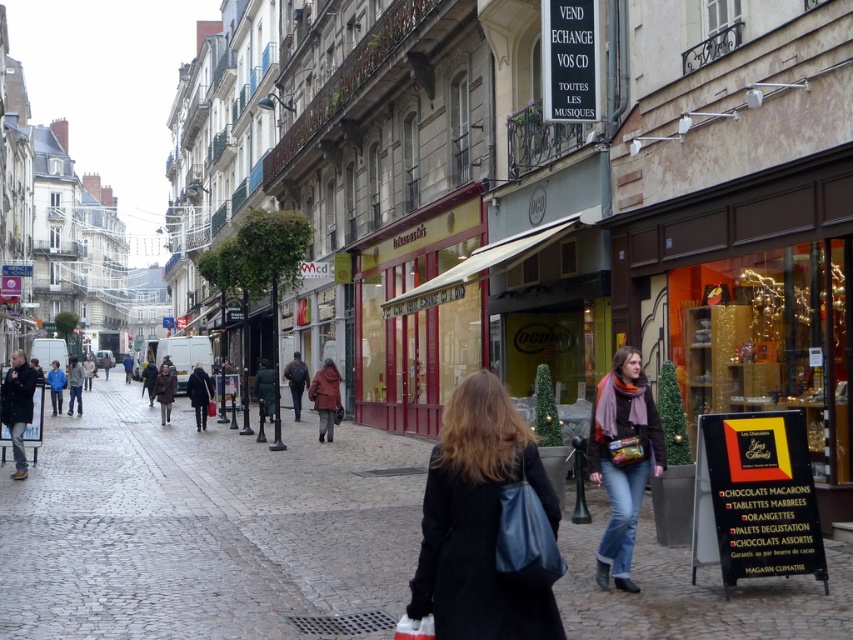
Question: Which of the following is the farthest from the observer?

Choices:
 (A) (537, 458)
 (B) (267, 576)
 (C) (596, 448)

Answer: (B)

Question: Which object is the farthest from the black leather coat at center?

Choices:
 (A) cobblestone pavement at center
 (B) denim jeans at center

Answer: (A)

Question: Is cobblestone pavement at center above black leather coat at center?

Choices:
 (A) yes
 (B) no

Answer: (B)

Question: Where is cobblestone pavement at center located in relation to denim jeans at center in the image?

Choices:
 (A) below
 (B) above

Answer: (A)

Question: Does cobblestone pavement at center have a greater width compared to denim jeans at center?

Choices:
 (A) no
 (B) yes

Answer: (B)

Question: Which object is the farthest from the denim jeans at center?

Choices:
 (A) black leather coat at center
 (B) cobblestone pavement at center

Answer: (B)